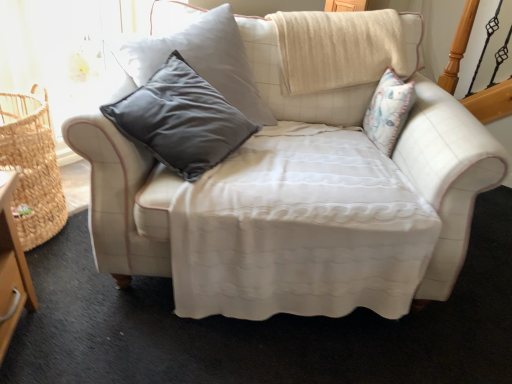
Identify the location of woven straw basket at left. (32, 167).

What do you see at coordinates (32, 167) in the screenshot? This screenshot has width=512, height=384. I see `woven straw basket at left` at bounding box center [32, 167].

What is the approximate height of white quilted fabric couch at center?

white quilted fabric couch at center is 34.47 inches tall.

At what (x,y) coordinates should I click in order to perform the action: click on white quilted fabric couch at center. Please return your answer as a coordinate pair (x, y). This screenshot has height=384, width=512. Looking at the image, I should click on (294, 216).

What do you see at coordinates (294, 216) in the screenshot? This screenshot has height=384, width=512. I see `white quilted fabric couch at center` at bounding box center [294, 216].

I want to click on woven straw basket at left, so pos(32,167).

Based on their positions, is white quilted fabric couch at center located to the left or right of woven straw basket at left?

Clearly, white quilted fabric couch at center is on the right of woven straw basket at left in the image.

Which object is closer to the camera taking this photo, white quilted fabric couch at center or woven straw basket at left?

white quilted fabric couch at center is in front.

Which is further, (331, 112) or (16, 199)?

The point (331, 112) is behind.

From the image's perspective, does white quilted fabric couch at center appear lower than woven straw basket at left?

Incorrect, from the image's perspective, white quilted fabric couch at center is higher than woven straw basket at left.

From a real-world perspective, is white quilted fabric couch at center physically located above or below woven straw basket at left?

In terms of real-world spatial position, white quilted fabric couch at center is above woven straw basket at left.

Between white quilted fabric couch at center and woven straw basket at left, which one has smaller width?

woven straw basket at left.

Considering the sizes of white quilted fabric couch at center and woven straw basket at left in the image, is white quilted fabric couch at center taller or shorter than woven straw basket at left?

In the image, white quilted fabric couch at center appears to be taller than woven straw basket at left.

Does white quilted fabric couch at center have a larger size compared to woven straw basket at left?

Yes, white quilted fabric couch at center is bigger than woven straw basket at left.

Is white quilted fabric couch at center surrounding woven straw basket at left?

No.

Is white quilted fabric couch at center in contact with woven straw basket at left?

No, white quilted fabric couch at center is not with woven straw basket at left.

Consider the image. Is white quilted fabric couch at center facing away from woven straw basket at left?

No, white quilted fabric couch at center is not facing away from woven straw basket at left.

Measure the distance from white quilted fabric couch at center to woven straw basket at left.

white quilted fabric couch at center and woven straw basket at left are 29.50 inches apart.

This screenshot has width=512, height=384. Identify the location of studio couch in front of the woven straw basket at left. (294, 216).

Considering the relative positions of woven straw basket at left and white quilted fabric couch at center in the image provided, is woven straw basket at left to the left or to the right of white quilted fabric couch at center?

In the image, woven straw basket at left appears on the left side of white quilted fabric couch at center.

Is woven straw basket at left in front of or behind white quilted fabric couch at center in the image?

In the image, woven straw basket at left appears behind white quilted fabric couch at center.

Does point (38, 130) appear closer or farther from the camera than point (182, 200)?

Point (38, 130) is farther from the camera than point (182, 200).

From the image's perspective, between woven straw basket at left and white quilted fabric couch at center, who is located below?

From the image's view, woven straw basket at left is below.

From a real-world perspective, who is located lower, woven straw basket at left or white quilted fabric couch at center?

woven straw basket at left is physically lower.

In terms of width, does woven straw basket at left look wider or thinner when compared to white quilted fabric couch at center?

In the image, woven straw basket at left appears to be more narrow than white quilted fabric couch at center.

Based on the photo, between woven straw basket at left and white quilted fabric couch at center, which one has less height?

woven straw basket at left.

Does woven straw basket at left have a larger size compared to white quilted fabric couch at center?

Incorrect, woven straw basket at left is not larger than white quilted fabric couch at center.

Based on the photo, is woven straw basket at left situated inside white quilted fabric couch at center or outside?

woven straw basket at left is located beyond the bounds of white quilted fabric couch at center.

Is woven straw basket at left far from white quilted fabric couch at center?

They are positioned close to each other.

Does woven straw basket at left turn towards white quilted fabric couch at center?

Yes, woven straw basket at left is facing white quilted fabric couch at center.

Can you tell me how much woven straw basket at left and white quilted fabric couch at center differ in facing direction?

The angular difference between woven straw basket at left and white quilted fabric couch at center is 49.3 degrees.

You are a GUI agent. You are given a task and a screenshot of the screen. Output one action in this format:
    pyautogui.click(x=<x>, y=<y>)
    Task: Click on the studio couch on the right side of woven straw basket at left
    This screenshot has width=512, height=384.
    Given the screenshot: What is the action you would take?
    pyautogui.click(x=294, y=216)

Locate an element on the screen. This screenshot has width=512, height=384. studio couch that is above the woven straw basket at left (from a real-world perspective) is located at coordinates (294, 216).

Find the location of a particular element. basket on the left of white quilted fabric couch at center is located at coordinates (32, 167).